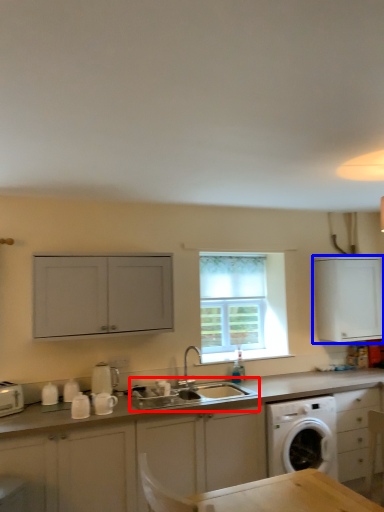
Question: Which point is closer to the camera, sink (highlighted by a red box) or cabinetry (highlighted by a blue box)?

Choices:
 (A) sink
 (B) cabinetry

Answer: (A)